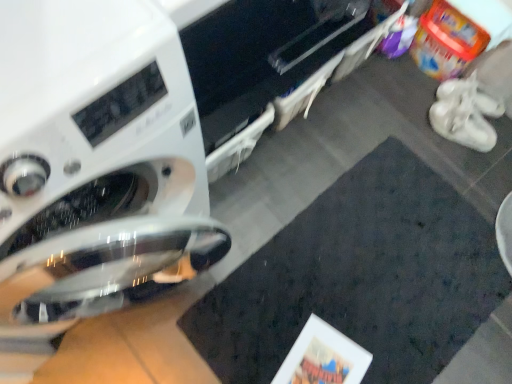
Describe the element at coordinates (361, 277) in the screenshot. This screenshot has height=384, width=512. I see `dark matte mat at center` at that location.

Measure the distance between white matte shoe at right and camera.

white matte shoe at right is 1.55 meters away from camera.

The height and width of the screenshot is (384, 512). What do you see at coordinates (471, 95) in the screenshot?
I see `white matte shoe at right` at bounding box center [471, 95].

Find the location of a particular element. This screenshot has width=512, height=384. white glossy washing machine at left is located at coordinates (94, 169).

Identify the location of dark matte mat at center. (361, 277).

Is white suede sneakers at right inside or outside of white glossy washing machine at left?

white suede sneakers at right is not enclosed by white glossy washing machine at left.

How many degrees apart are the facing directions of white suede sneakers at right and white glossy washing machine at left?

There is a 152-degree angle between the facing directions of white suede sneakers at right and white glossy washing machine at left.

Looking at this image, is white suede sneakers at right taller or shorter than white glossy washing machine at left?

Considering their sizes, white suede sneakers at right has less height than white glossy washing machine at left.

From a real-world perspective, is white suede sneakers at right above or below white glossy washing machine at left?

From a real-world perspective, white suede sneakers at right is physically below white glossy washing machine at left.

How many degrees apart are the facing directions of white suede sneakers at right and dark matte mat at center?

There is a 62.3-degree angle between the facing directions of white suede sneakers at right and dark matte mat at center.

From a real-world perspective, which is physically below, white suede sneakers at right or dark matte mat at center?

dark matte mat at center is physically lower.

Which of these two, white suede sneakers at right or dark matte mat at center, is thinner?

white suede sneakers at right is thinner.

From the image's perspective, between white suede sneakers at right and dark matte mat at center, who is located below?

dark matte mat at center.

Based on their sizes in the image, would you say white glossy washing machine at left is bigger or smaller than white matte shoe at right?

In the image, white glossy washing machine at left appears to be larger than white matte shoe at right.

How many degrees apart are the facing directions of white glossy washing machine at left and white matte shoe at right?

Answer: 146 degrees.

Can you confirm if white glossy washing machine at left is positioned to the right of white matte shoe at right?

No.

Is white glossy washing machine at left positioned before white matte shoe at right?

Yes, white glossy washing machine at left is closer to the viewer.

Is dark matte mat at center surrounding white glossy washing machine at left?

No, white glossy washing machine at left is not inside dark matte mat at center.

Considering the relative sizes of dark matte mat at center and white glossy washing machine at left in the image provided, is dark matte mat at center shorter than white glossy washing machine at left?

Indeed, dark matte mat at center has a lesser height compared to white glossy washing machine at left.

From the image's perspective, does dark matte mat at center appear lower than white glossy washing machine at left?

Yes.

Which object is further away from the camera taking this photo, dark matte mat at center or white glossy washing machine at left?

dark matte mat at center is more distant.

Considering the relative sizes of white matte shoe at right and white suede sneakers at right in the image provided, is white matte shoe at right taller than white suede sneakers at right?

Incorrect, the height of white matte shoe at right is not larger of that of white suede sneakers at right.

Can you see white matte shoe at right touching white suede sneakers at right?

Yes, the surface of white matte shoe at right is in contact with white suede sneakers at right.

Considering the sizes of objects white matte shoe at right and white suede sneakers at right in the image provided, who is thinner, white matte shoe at right or white suede sneakers at right?

white suede sneakers at right is thinner.

Is white matte shoe at right oriented away from white suede sneakers at right?

No, white matte shoe at right's orientation is not away from white suede sneakers at right.

Is dark matte mat at center looking in the opposite direction of white suede sneakers at right?

No, dark matte mat at center is not facing away from white suede sneakers at right.

Is point (291, 308) closer or farther from the camera than point (484, 142)?

Point (291, 308) appears to be closer to the viewer than point (484, 142).

Would you say white suede sneakers at right is part of dark matte mat at center's contents?

No, white suede sneakers at right is not inside dark matte mat at center.

Who is shorter, dark matte mat at center or white suede sneakers at right?

dark matte mat at center is shorter.

Is white matte shoe at right bigger than dark matte mat at center?

No.

Find the location of `shoe behind the dark matte mat at center`. shoe behind the dark matte mat at center is located at coordinates (471, 95).

Is white matte shoe at right turned away from dark matte mat at center?

No, dark matte mat at center is not at the back of white matte shoe at right.

Is white matte shoe at right inside the boundaries of dark matte mat at center, or outside?

white matte shoe at right is outside dark matte mat at center.

The image size is (512, 384). Identify the location of footwear above the white glossy washing machine at left (from the image's perspective). (465, 114).

At what (x,y) coordinates should I click in order to perform the action: click on mat in front of the white suede sneakers at right. Please return your answer as a coordinate pair (x, y). This screenshot has height=384, width=512. Looking at the image, I should click on (361, 277).

Considering their positions, is white glossy washing machine at left positioned closer to white matte shoe at right than dark matte mat at center?

dark matte mat at center lies closer to white matte shoe at right than the other object.

Looking at the image, which one is located further to white matte shoe at right, dark matte mat at center or white suede sneakers at right?

The object further to white matte shoe at right is dark matte mat at center.

Looking at this image, which object lies further to the anchor point white matte shoe at right, white glossy washing machine at left or white suede sneakers at right?

white glossy washing machine at left.

Consider the image. From the image, which object appears to be nearer to white suede sneakers at right, dark matte mat at center or white matte shoe at right?

white matte shoe at right is closer to white suede sneakers at right.

Based on their spatial positions, is white glossy washing machine at left or white matte shoe at right further from white suede sneakers at right?

white glossy washing machine at left is positioned further to the anchor white suede sneakers at right.

From the image, which object appears to be farther from white matte shoe at right, white suede sneakers at right or white glossy washing machine at left?

white glossy washing machine at left.

When comparing their distances from dark matte mat at center, does white matte shoe at right or white glossy washing machine at left seem closer?

white glossy washing machine at left is positioned closer to the anchor dark matte mat at center.

Estimate the real-world distances between objects in this image. Which object is further from white suede sneakers at right, white glossy washing machine at left or dark matte mat at center?

Based on the image, white glossy washing machine at left appears to be further to white suede sneakers at right.

You are a GUI agent. You are given a task and a screenshot of the screen. Output one action in this format:
    pyautogui.click(x=<x>, y=<y>)
    Task: Click on the footwear between white glossy washing machine at left and white matte shoe at right in the horizontal direction
    
    Given the screenshot: What is the action you would take?
    pyautogui.click(x=465, y=114)

I want to click on mat between white glossy washing machine at left and white suede sneakers at right, so click(x=361, y=277).

Find the location of `mat situated between white glossy washing machine at left and white matte shoe at right from left to right`. mat situated between white glossy washing machine at left and white matte shoe at right from left to right is located at coordinates (361, 277).

Image resolution: width=512 pixels, height=384 pixels. What are the coordinates of `footwear between white matte shoe at right and dark matte mat at center from top to bottom` in the screenshot? It's located at (465, 114).